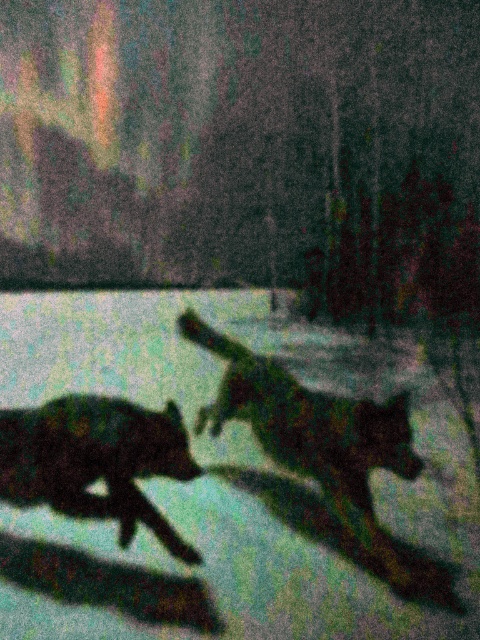
Question: Which object is closer to the camera taking this photo?

Choices:
 (A) silhouette fur at lower left
 (B) shiny black dog at center

Answer: (B)

Question: Does shiny black dog at center lie behind silhouette fur at lower left?

Choices:
 (A) yes
 (B) no

Answer: (B)

Question: Is shiny black dog at center closer to camera compared to silhouette fur at lower left?

Choices:
 (A) yes
 (B) no

Answer: (A)

Question: Which object appears farthest from the camera in this image?

Choices:
 (A) silhouette fur at lower left
 (B) shiny black dog at center

Answer: (A)

Question: Is shiny black dog at center positioned before silhouette fur at lower left?

Choices:
 (A) no
 (B) yes

Answer: (B)

Question: Which point is closer to the camera?

Choices:
 (A) shiny black dog at center
 (B) silhouette fur at lower left

Answer: (A)